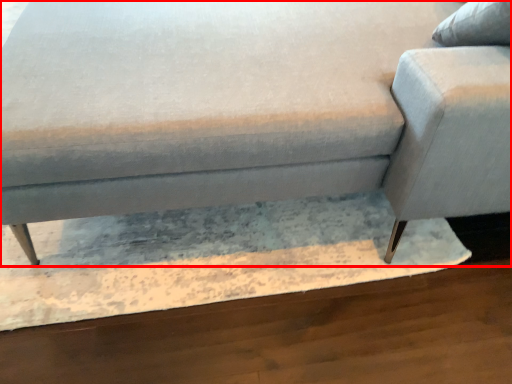
Question: Where is studio couch (annotated by the red box) located in relation to swivel chair in the image?

Choices:
 (A) left
 (B) right

Answer: (A)